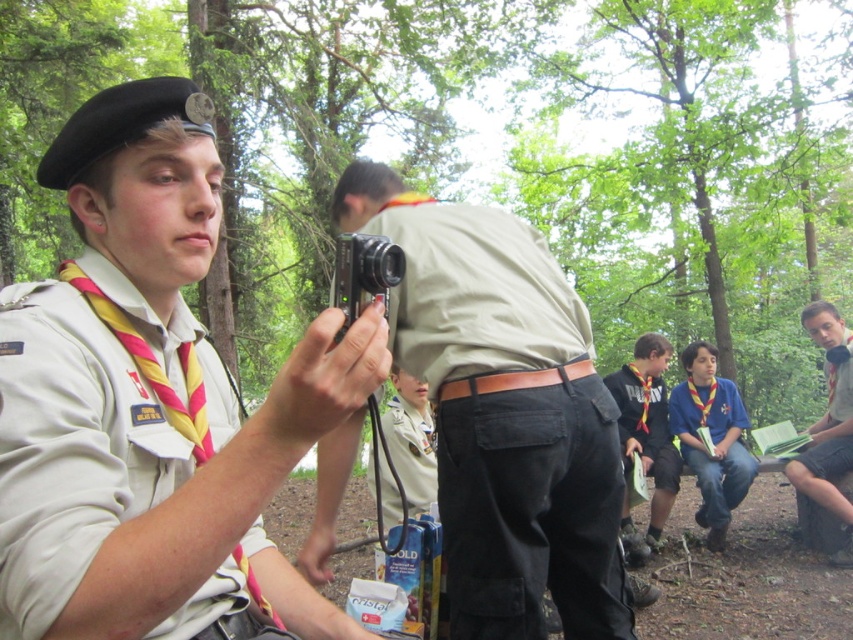
Based on the photo, you are a hiker trying to decide which item to take with you based on size. The khaki fabric shirt at center and the yellow fabric scarf at lower right are both available. Which item takes up more space?

The yellow fabric scarf at lower right takes up more space because it is larger than the khaki fabric shirt at center.

You are a photographer trying to capture a photo of both the white cotton shirt at left and the yellow fabric scarf at lower right. Which object should you focus on first if you want to ensure both are in the frame?

The white cotton shirt at left is shorter than the yellow fabric scarf at lower right, so you should focus on the white cotton shirt at left first to ensure both are in the frame.

You are a photographer trying to capture both the khaki fabric shirt at center and the yellow fabric scarf at lower right in a single shot. Based on their positions, which object will appear closer to the camera in the photo?

The khaki fabric shirt at center will appear closer to the camera in the photo because it is positioned in front of the yellow fabric scarf at lower right.